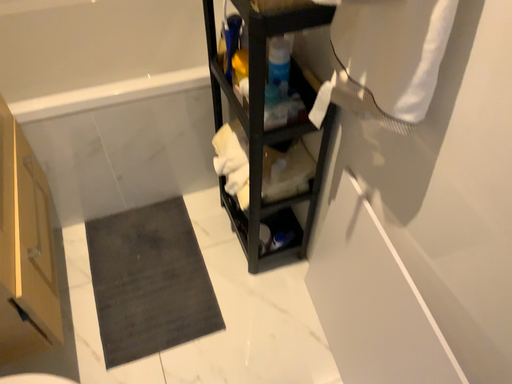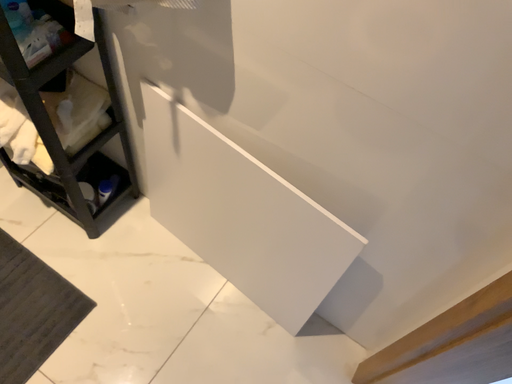
Question: Which way did the camera rotate in the video?

Choices:
 (A) rotated right
 (B) rotated left

Answer: (A)